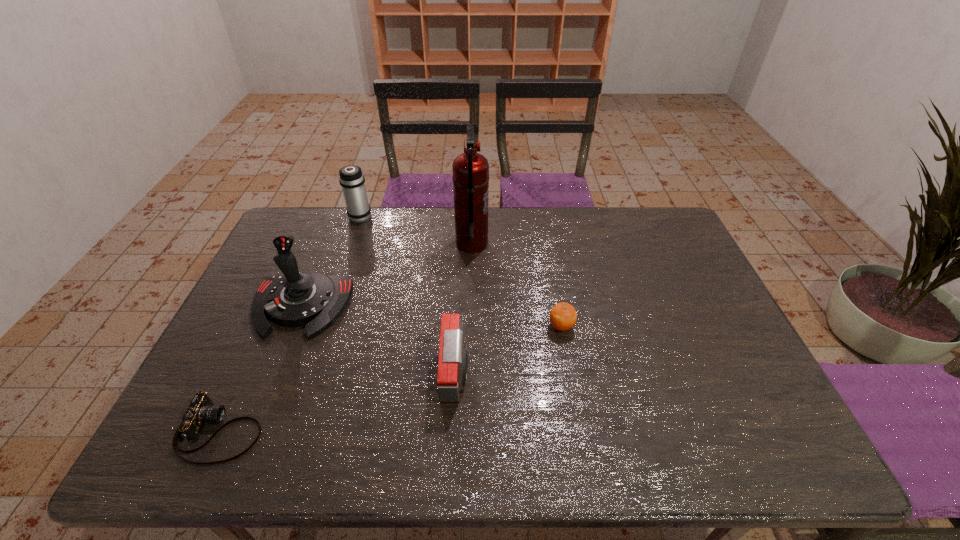
Find the location of a particular element. This screenshot has width=960, height=540. free space that satisfies the following two spatial constraints: 1. on the nozzle side of the fire extinguisher; 2. on the handle side of the joystick is located at coordinates (470, 307).